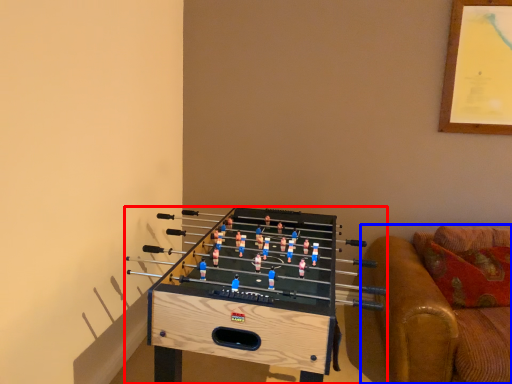
Question: Among these objects, which one is farthest to the camera, furniture (highlighted by a red box) or studio couch (highlighted by a blue box)?

Choices:
 (A) furniture
 (B) studio couch

Answer: (B)